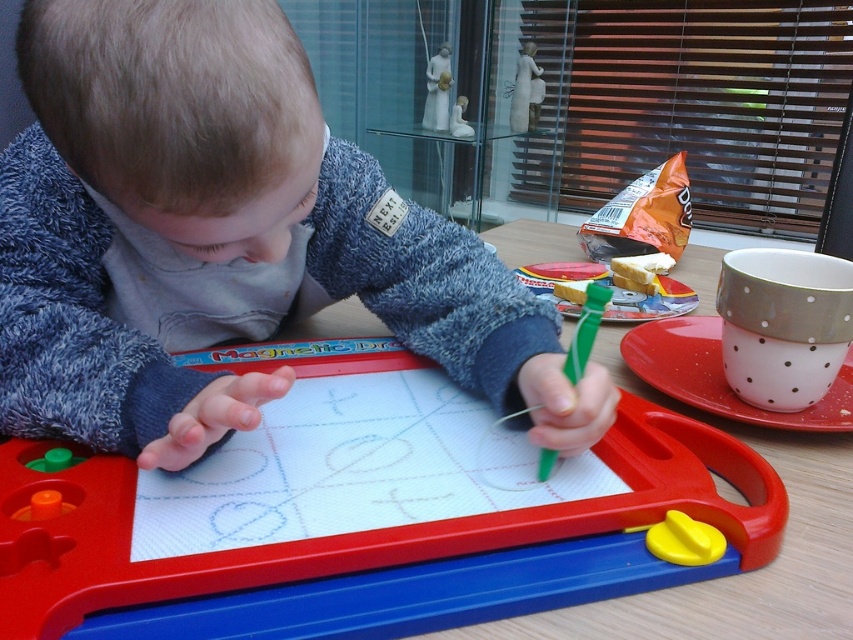
In the scene shown: Is soft blue sweater at center taller than green plastic crayon at center?

Correct, soft blue sweater at center is much taller as green plastic crayon at center.

Which is more to the right, soft blue sweater at center or green plastic crayon at center?

Positioned to the right is green plastic crayon at center.

Between point (199, 218) and point (547, 451), which one is positioned behind?

Positioned behind is point (547, 451).

The width and height of the screenshot is (853, 640). I want to click on soft blue sweater at center, so click(222, 237).

How far apart are wooden table at center and green plastic crayon at center?

The distance of wooden table at center from green plastic crayon at center is 12.18 inches.

Is wooden table at center positioned at the back of green plastic crayon at center?

No, wooden table at center is in front of green plastic crayon at center.

What do you see at coordinates (740, 573) in the screenshot? Image resolution: width=853 pixels, height=640 pixels. I see `wooden table at center` at bounding box center [740, 573].

The image size is (853, 640). I want to click on wooden table at center, so click(x=740, y=573).

Who is more forward, (553, 403) or (535, 632)?

Point (535, 632)

Identify the location of soft blue sweater at center. (222, 237).